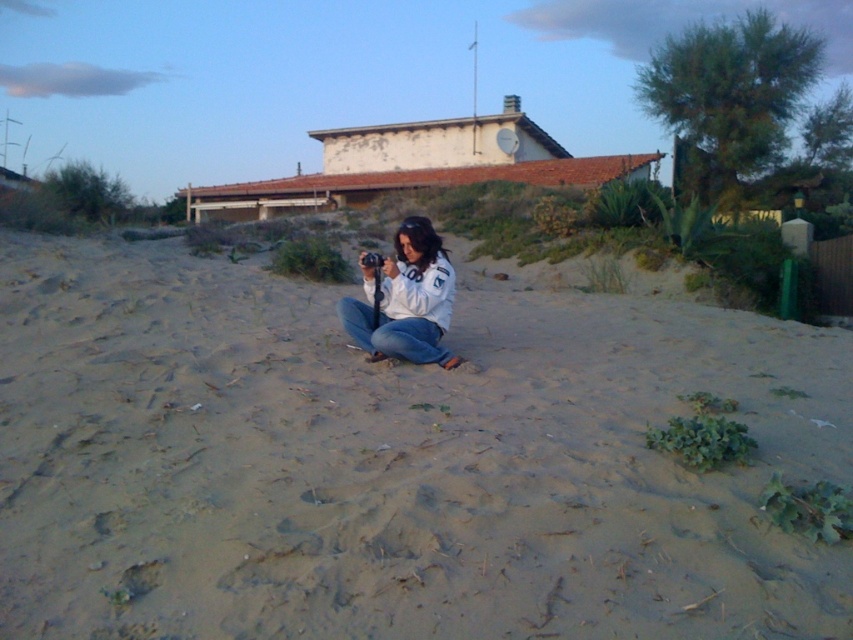
You are a photographer trying to capture a closeup of the white matte jacket at center. Since the sandy beige sand at center is in the way, can you tell me if you need to move the sand or the jacket to get the shot?

The sandy beige sand at center is larger in size than the white matte jacket at center, so you would need to move the sand out of the way to get a clear closeup of the jacket.

You are a photographer trying to capture a clear shot of the white matte jacket at center. However, the sandy beige sand at center is blocking part of the jacket. Can you adjust your position to avoid the sand blocking the jacket?

The sandy beige sand at center is positioned under the white matte jacket at center, so moving the camera slightly upward or forward could help avoid the sand blocking the jacket.

You are standing at the origin of the coordinate system in the beach scene. There are two points marked in the image. Which point is closer to you, point (816,353) or point (402,300)?

Point (402,300) is closer to you because it is in front of point (816,353).